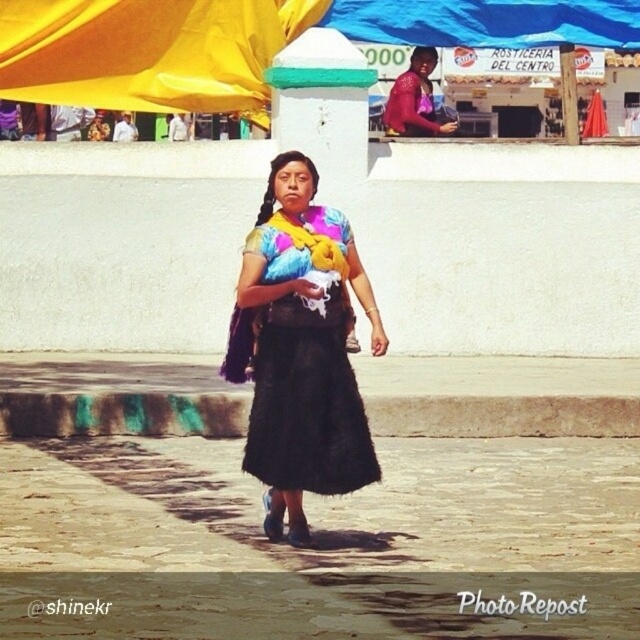
Question: Does black fuzzy skirt at center appear over blue tarpaulin at upper center?

Choices:
 (A) yes
 (B) no

Answer: (B)

Question: Does yellow fabric canopy at upper left come in front of blue tarpaulin at upper center?

Choices:
 (A) no
 (B) yes

Answer: (B)

Question: Which point is closer to the camera taking this photo?

Choices:
 (A) (390, 32)
 (B) (120, 45)
 (C) (428, 86)

Answer: (B)

Question: Can you confirm if blue tarpaulin at upper center is wider than matte red blouse at upper center?

Choices:
 (A) yes
 (B) no

Answer: (A)

Question: Estimate the real-world distances between objects in this image. Which object is closer to the yellow fabric canopy at upper left?

Choices:
 (A) blue tarpaulin at upper center
 (B) matte red blouse at upper center
 (C) black fuzzy skirt at center

Answer: (A)

Question: Which point is farther to the camera?

Choices:
 (A) matte red blouse at upper center
 (B) blue tarpaulin at upper center

Answer: (A)